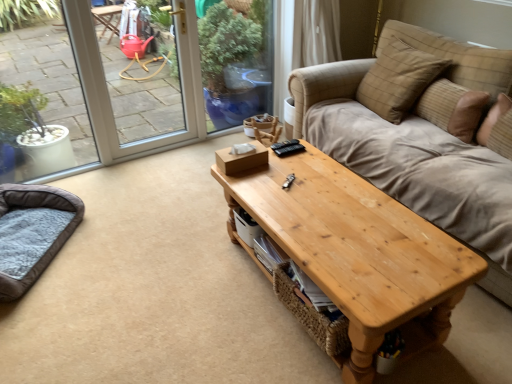
Image resolution: width=512 pixels, height=384 pixels. I want to click on free space to the left of natural wood coffee table at center, so click(x=176, y=313).